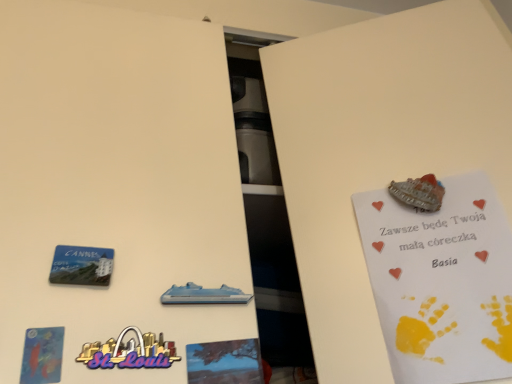
Image resolution: width=512 pixels, height=384 pixels. Describe the element at coordinates (441, 282) in the screenshot. I see `white paper postcard at upper right, which is counted as the first postcard, starting from the right` at that location.

What do you see at coordinates (42, 355) in the screenshot? I see `matte blue postcard at lower left, positioned as the first postcard in front-to-back order` at bounding box center [42, 355].

You are a GUI agent. You are given a task and a screenshot of the screen. Output one action in this format:
    pyautogui.click(x=<x>, y=<y>)
    Task: Click on the matte blue postcard at lower left, placed as the second postcard when sorted from back to front
    The width and height of the screenshot is (512, 384).
    Given the screenshot: What is the action you would take?
    pyautogui.click(x=42, y=355)

Describe the element at coordinates (225, 362) in the screenshot. I see `blue matte tree at center` at that location.

At what (x,y) coordinates should I click in order to perform the action: click on white paper postcard at upper right, which is the 1th postcard in back-to-front order. Please return your answer as a coordinate pair (x, y). Image resolution: width=512 pixels, height=384 pixels. Looking at the image, I should click on click(441, 282).

Which is more to the left, blue plastic cruise ship at center or matte blue postcard at lower left, the first postcard from the left?

Positioned to the left is matte blue postcard at lower left, the first postcard from the left.

Identify the location of vehicle that is above the matte blue postcard at lower left, acting as the second postcard starting from the right (from a real-world perspective). The height and width of the screenshot is (384, 512). (204, 295).

Are blue plastic cruise ship at center and matte blue postcard at lower left, the first postcard from the left, far apart?

They are positioned close to each other.

From the image's perspective, which is above, matte blue postcard at lower left, positioned as the first postcard in front-to-back order, or blue plastic cruise ship at center?

From the image's view, blue plastic cruise ship at center is above.

Which object is positioned more to the right, matte blue postcard at lower left, positioned as the first postcard in front-to-back order, or blue plastic cruise ship at center?

Positioned to the right is blue plastic cruise ship at center.

Which object is further away from the camera taking this photo, matte blue postcard at lower left, placed as the second postcard when sorted from back to front, or blue plastic cruise ship at center?

blue plastic cruise ship at center.

Is blue plastic cruise ship at center surrounded by matte blue postcard at lower left, acting as the second postcard starting from the right?

Definitely not — blue plastic cruise ship at center is not inside matte blue postcard at lower left, acting as the second postcard starting from the right.

Does blue plastic cruise ship at center turn towards blue plastic magnet at lower left?

No, blue plastic cruise ship at center is not oriented towards blue plastic magnet at lower left.

What's the angular difference between blue plastic cruise ship at center and blue plastic magnet at lower left's facing directions?

blue plastic cruise ship at center and blue plastic magnet at lower left are facing 0.0248 degrees away from each other.

From a real-world perspective, is blue plastic cruise ship at center positioned under blue plastic magnet at lower left based on gravity?

Indeed, from a real-world perspective, blue plastic cruise ship at center is positioned beneath blue plastic magnet at lower left.

From the image's perspective, which one is positioned higher, blue plastic cruise ship at center or blue plastic magnet at lower left?

blue plastic magnet at lower left.

Is blue matte tree at center positioned far away from matte blue postcard at lower left, acting as the second postcard starting from the right?

No, blue matte tree at center is in close proximity to matte blue postcard at lower left, acting as the second postcard starting from the right.

Is blue matte tree at center at the right side of matte blue postcard at lower left, placed as the second postcard when sorted from back to front?

Yes.

What's the angular difference between blue matte tree at center and matte blue postcard at lower left, acting as the second postcard starting from the right,'s facing directions?

0.983 degrees separate the facing orientations of blue matte tree at center and matte blue postcard at lower left, acting as the second postcard starting from the right.

Would you say blue matte tree at center is outside matte blue postcard at lower left, positioned as the first postcard in front-to-back order?

Yes.

Is blue matte tree at center bigger or smaller than white paper postcard at upper right, which is the 1th postcard in back-to-front order?

Clearly, blue matte tree at center is smaller in size than white paper postcard at upper right, which is the 1th postcard in back-to-front order.

Considering the points (255, 376) and (471, 252), which point is in front, point (255, 376) or point (471, 252)?

Positioned in front is point (255, 376).

Is blue matte tree at center oriented towards white paper postcard at upper right, positioned as the second postcard in left-to-right order?

No, blue matte tree at center is not facing towards white paper postcard at upper right, positioned as the second postcard in left-to-right order.

Is blue matte tree at center thinner than white paper postcard at upper right, the second postcard when ordered from front to back?

No.

Who is shorter, blue matte tree at center or blue plastic cruise ship at center?

Standing shorter between the two is blue plastic cruise ship at center.

From the image's perspective, which one is positioned lower, blue matte tree at center or blue plastic cruise ship at center?

blue matte tree at center, from the image's perspective.

Is blue matte tree at center thinner than blue plastic cruise ship at center?

In fact, blue matte tree at center might be wider than blue plastic cruise ship at center.

Can you tell me how much blue matte tree at center and blue plastic cruise ship at center differ in facing direction?

blue matte tree at center and blue plastic cruise ship at center are facing 0.131 degrees away from each other.

Can you confirm if blue plastic cruise ship at center is taller than white paper postcard at upper right, the second postcard when ordered from front to back?

Incorrect, the height of blue plastic cruise ship at center is not larger of that of white paper postcard at upper right, the second postcard when ordered from front to back.

Consider the image. From a real-world perspective, is blue plastic cruise ship at center beneath white paper postcard at upper right, which is counted as the first postcard, starting from the right?

Yes, from a real-world perspective, blue plastic cruise ship at center is beneath white paper postcard at upper right, which is counted as the first postcard, starting from the right.

How different are the orientations of blue plastic cruise ship at center and white paper postcard at upper right, the second postcard when ordered from front to back, in degrees?

They differ by 25.8 degrees in their facing directions.

Is blue plastic cruise ship at center oriented away from white paper postcard at upper right, the second postcard when ordered from front to back?

No, blue plastic cruise ship at center is not facing away from white paper postcard at upper right, the second postcard when ordered from front to back.

Find the location of a particular element. This screenshot has width=512, height=384. vehicle on the right of matte blue postcard at lower left, placed as the second postcard when sorted from back to front is located at coordinates (204, 295).

In the image, there is a blue plastic cruise ship at center. Identify the location of postcard below it (from the image's perspective). The image size is (512, 384). (42, 355).

From the image, which object appears to be farther from matte blue postcard at lower left, the first postcard from the left, blue plastic magnet at lower left or blue plastic cruise ship at center?

The object further to matte blue postcard at lower left, the first postcard from the left, is blue plastic cruise ship at center.

In the scene shown: Estimate the real-world distances between objects in this image. Which object is further from blue plastic magnet at lower left, blue plastic cruise ship at center or white paper postcard at upper right, the second postcard when ordered from front to back?

white paper postcard at upper right, the second postcard when ordered from front to back.

Estimate the real-world distances between objects in this image. Which object is closer to blue matte tree at center, blue plastic magnet at lower left or matte blue postcard at lower left, the first postcard from the left?

blue plastic magnet at lower left is positioned closer to the anchor blue matte tree at center.

When comparing their distances from matte blue postcard at lower left, acting as the second postcard starting from the right, does white paper postcard at upper right, which is counted as the first postcard, starting from the right, or blue matte tree at center seem closer?

blue matte tree at center is positioned closer to the anchor matte blue postcard at lower left, acting as the second postcard starting from the right.

Considering their positions, is matte blue postcard at lower left, acting as the second postcard starting from the right, positioned further to blue plastic cruise ship at center than white paper postcard at upper right, positioned as the second postcard in left-to-right order?

white paper postcard at upper right, positioned as the second postcard in left-to-right order, is positioned further to the anchor blue plastic cruise ship at center.

From the image, which object appears to be farther from white paper postcard at upper right, the second postcard when ordered from front to back, blue matte tree at center or blue plastic cruise ship at center?

blue plastic cruise ship at center lies further to white paper postcard at upper right, the second postcard when ordered from front to back, than the other object.

Which object lies nearer to the anchor point white paper postcard at upper right, which is the 1th postcard in back-to-front order, blue plastic magnet at lower left or blue matte tree at center?

blue matte tree at center is positioned closer to the anchor white paper postcard at upper right, which is the 1th postcard in back-to-front order.

Which object lies nearer to the anchor point blue plastic magnet at lower left, blue matte tree at center or blue plastic cruise ship at center?

Based on the image, blue plastic cruise ship at center appears to be nearer to blue plastic magnet at lower left.

Find the location of a particular element. The height and width of the screenshot is (384, 512). vehicle between blue plastic magnet at lower left and blue matte tree at center from left to right is located at coordinates (204, 295).

At what (x,y) coordinates should I click in order to perform the action: click on vehicle between matte blue postcard at lower left, placed as the second postcard when sorted from back to front, and white paper postcard at upper right, positioned as the second postcard in left-to-right order, in the horizontal direction. Please return your answer as a coordinate pair (x, y). This screenshot has height=384, width=512. Looking at the image, I should click on (204, 295).

At what (x,y) coordinates should I click in order to perform the action: click on plaque located between matte blue postcard at lower left, the first postcard from the left, and blue matte tree at center in the left-right direction. Please return your answer as a coordinate pair (x, y). This screenshot has height=384, width=512. Looking at the image, I should click on (x=82, y=265).

Find the location of `plaque between matte blue postcard at lower left, acting as the second postcard starting from the right, and blue plastic cruise ship at center, in the horizontal direction`. plaque between matte blue postcard at lower left, acting as the second postcard starting from the right, and blue plastic cruise ship at center, in the horizontal direction is located at coordinates (82, 265).